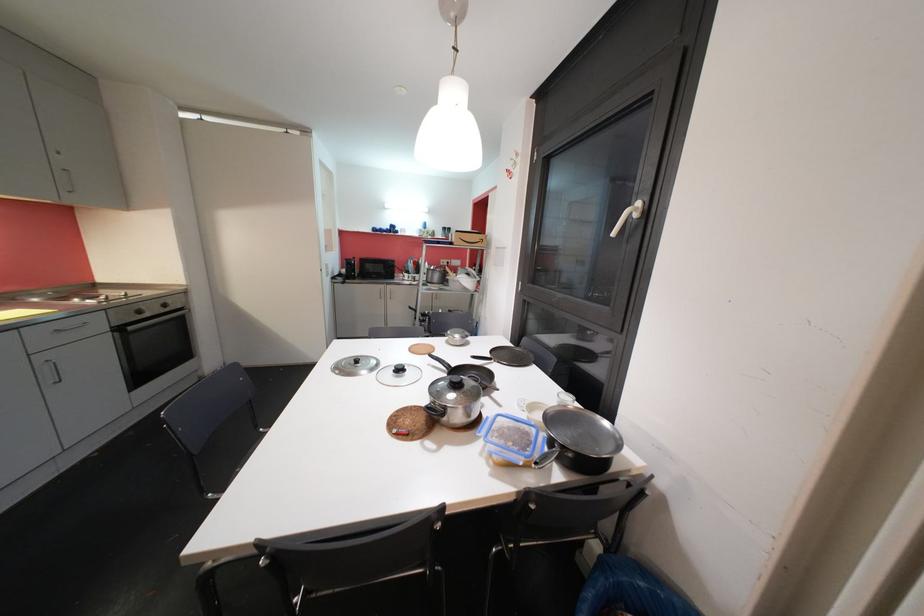
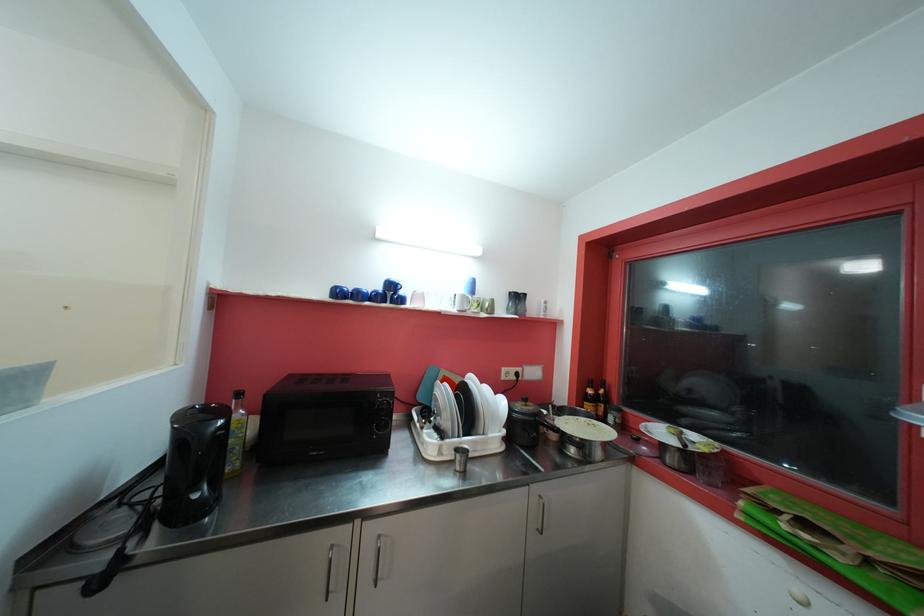
The point at (397, 229) is marked in the first image. Where is the corresponding point in the second image?

(396, 288)